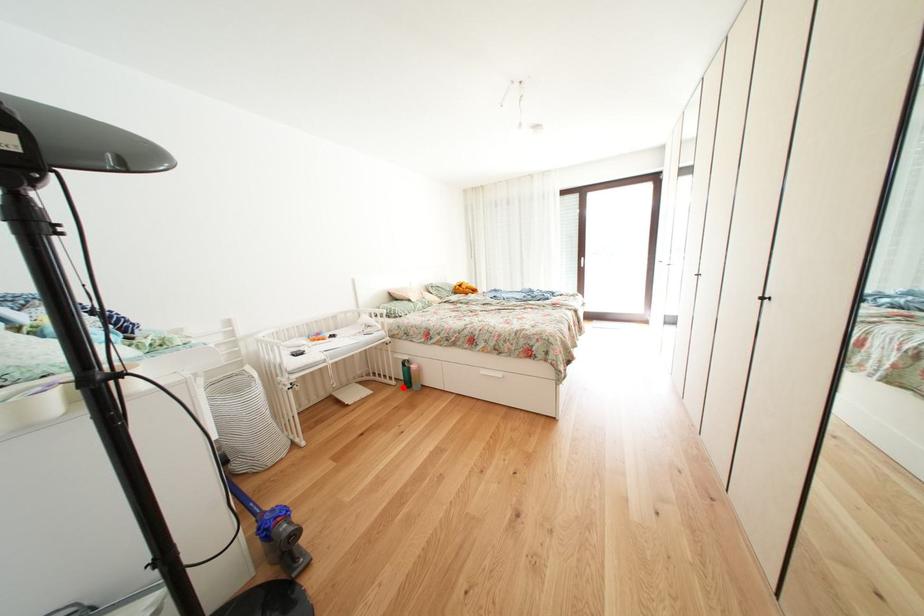
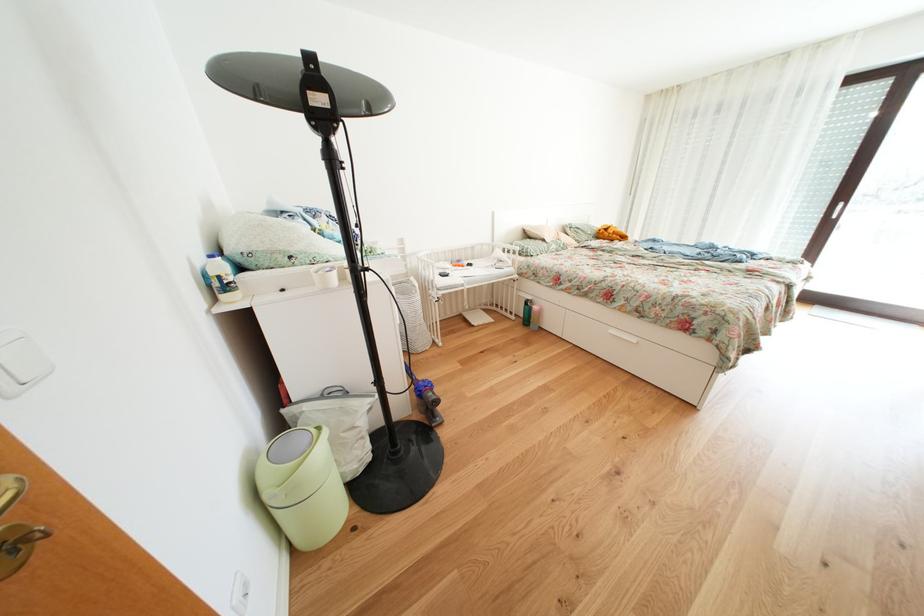
The point at the highlighted location is marked in the first image. Where is the corresponding point in the second image?

(523, 323)